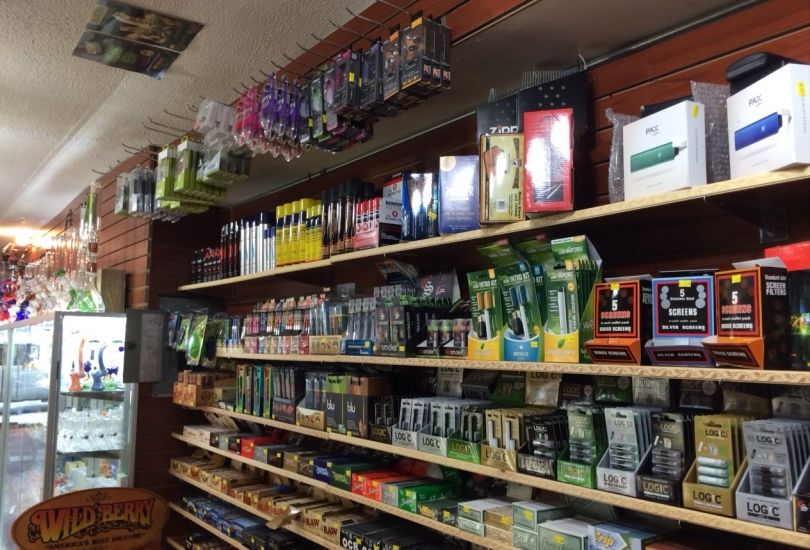
This screenshot has height=550, width=810. Find the location of `hooks`. hooks is located at coordinates (334, 45).